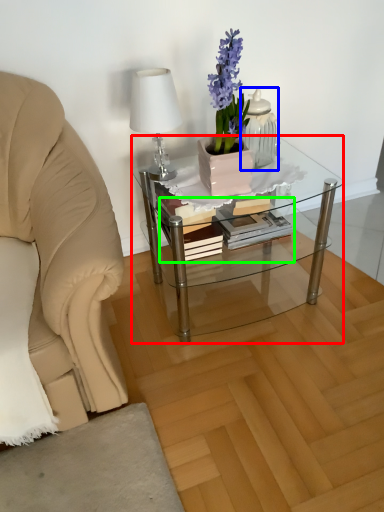
Question: Considering the real-world distances, which object is closest to coffee table (highlighted by a red box)? tableware (highlighted by a blue box) or book (highlighted by a green box).

Choices:
 (A) tableware
 (B) book

Answer: (B)